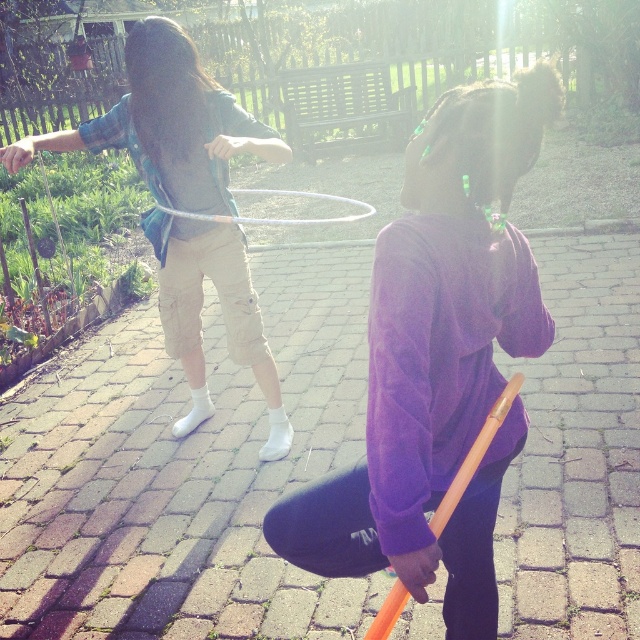
Question: Can you confirm if matte green shirt at center is positioned below metallic silver hula hoop at center?

Choices:
 (A) yes
 (B) no

Answer: (A)

Question: Which point is farther to the camera?

Choices:
 (A) (259, 221)
 (B) (454, 100)

Answer: (A)

Question: Which of the following is the farthest from the observer?

Choices:
 (A) metallic silver hula hoop at center
 (B) matte green shirt at center

Answer: (A)

Question: Does purple fleece sweatshirt at center appear under metallic silver hula hoop at center?

Choices:
 (A) no
 (B) yes

Answer: (B)

Question: Does matte green shirt at center appear on the right side of metallic silver hula hoop at center?

Choices:
 (A) yes
 (B) no

Answer: (B)

Question: Which point appears farthest from the camera in this image?

Choices:
 (A) (296, 193)
 (B) (189, 301)

Answer: (A)